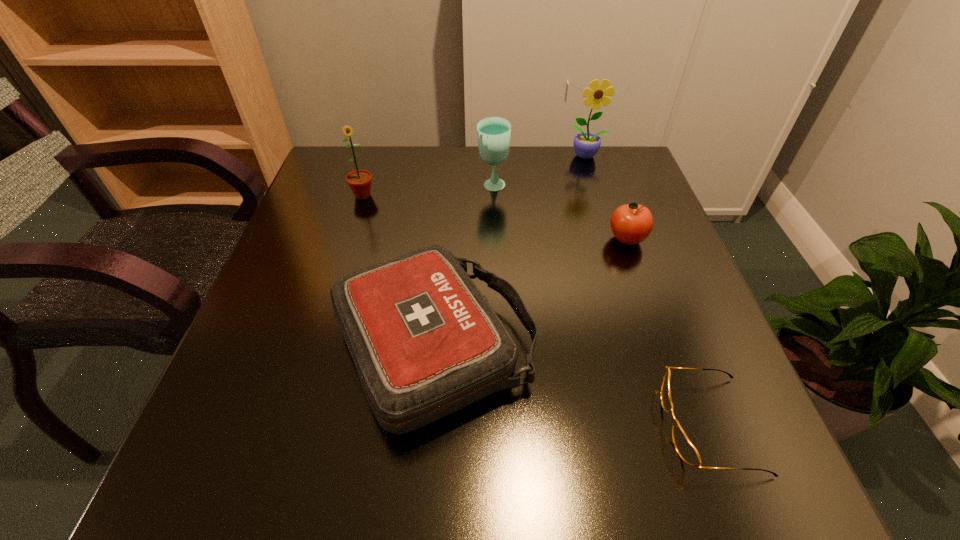
The image size is (960, 540). Find the location of `vacant space that is in between the nearer sunflower and the farther sunflower`. vacant space that is in between the nearer sunflower and the farther sunflower is located at coordinates (475, 176).

Find the location of a particular element. The height and width of the screenshot is (540, 960). free space between the apple and the farther sunflower is located at coordinates (607, 198).

The image size is (960, 540). In order to click on object that stands as the fifth closest to the nearer sunflower in this screenshot , I will do `click(686, 450)`.

Point out which object is positioned as the fourth nearest to the farthest object. Please provide its 2D coordinates. Your answer should be formatted as a tuple, i.e. [(x, y)], where the tuple contains the x and y coordinates of a point satisfying the conditions above.

[(359, 181)]

Identify the location of vacant space that satisfies the following two spatial constraints: 1. on the face of the left sunflower; 2. on the left side of the third nearest object. Image resolution: width=960 pixels, height=540 pixels. (349, 239).

The height and width of the screenshot is (540, 960). I want to click on vacant space that satisfies the following two spatial constraints: 1. on the face of the first-aid kit; 2. on the right side of the nearer sunflower, so click(x=316, y=347).

I want to click on free spot that satisfies the following two spatial constraints: 1. on the face of the third nearest object; 2. on the left side of the left sunflower, so click(349, 239).